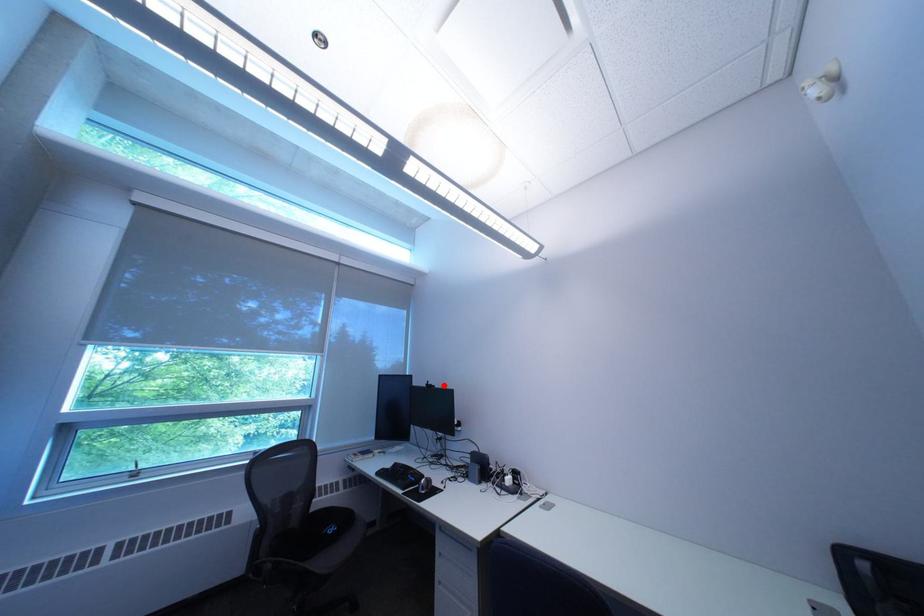
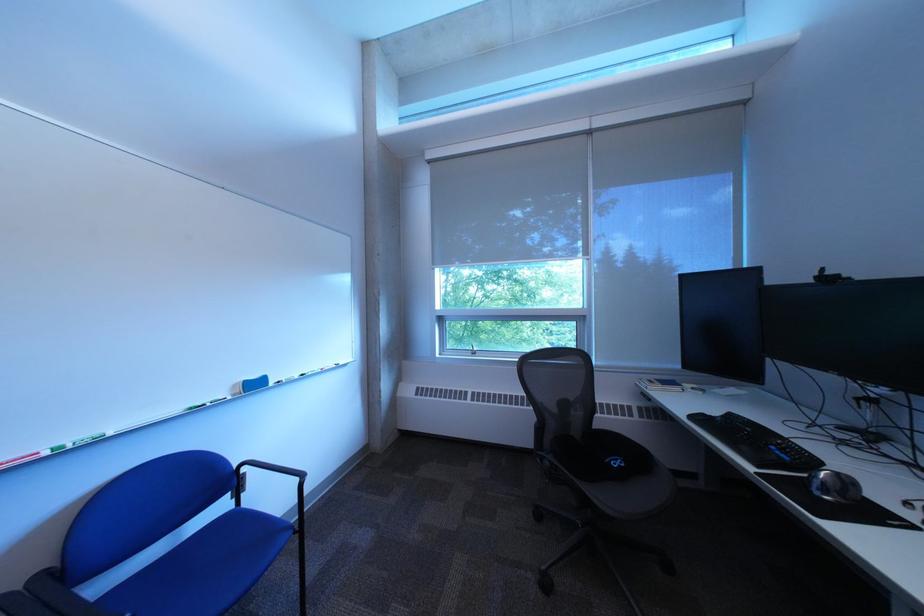
Where in the second image is the point corresponding to the highlighted location from the first image?

(843, 275)